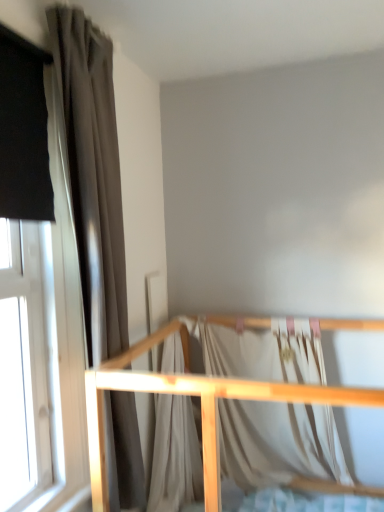
Question: Is light wood crib rail at lower center far away from silky white fabric at center?

Choices:
 (A) yes
 (B) no

Answer: (B)

Question: From a real-world perspective, is light wood crib rail at lower center beneath silky white fabric at center?

Choices:
 (A) no
 (B) yes

Answer: (B)

Question: Is light wood crib rail at lower center facing towards silky white fabric at center?

Choices:
 (A) no
 (B) yes

Answer: (B)

Question: Is silky white fabric at center inside light wood crib rail at lower center?

Choices:
 (A) yes
 (B) no

Answer: (A)

Question: Is light wood crib rail at lower center further to camera compared to silky white fabric at center?

Choices:
 (A) no
 (B) yes

Answer: (A)

Question: Would you say matte gray curtain at left is to the left or to the right of light wood crib rail at lower center in the picture?

Choices:
 (A) left
 (B) right

Answer: (A)

Question: From a real-world perspective, is matte gray curtain at left physically located above or below light wood crib rail at lower center?

Choices:
 (A) below
 (B) above

Answer: (B)

Question: Looking at the image, does matte gray curtain at left seem bigger or smaller compared to light wood crib rail at lower center?

Choices:
 (A) small
 (B) big

Answer: (A)

Question: Choose the correct answer: Is matte gray curtain at left inside light wood crib rail at lower center or outside it?

Choices:
 (A) inside
 (B) outside

Answer: (B)

Question: From the image's perspective, is light wood crib rail at lower center positioned above or below silky white fabric at center?

Choices:
 (A) above
 (B) below

Answer: (B)

Question: Based on their sizes in the image, would you say light wood crib rail at lower center is bigger or smaller than silky white fabric at center?

Choices:
 (A) small
 (B) big

Answer: (B)

Question: Based on their positions, is light wood crib rail at lower center located to the left or right of silky white fabric at center?

Choices:
 (A) left
 (B) right

Answer: (A)

Question: Is light wood crib rail at lower center inside or outside of silky white fabric at center?

Choices:
 (A) inside
 (B) outside

Answer: (B)

Question: In the image, is silky white fabric at center on the left side or the right side of light wood crib rail at lower center?

Choices:
 (A) left
 (B) right

Answer: (B)

Question: From a real-world perspective, relative to light wood crib rail at lower center, is silky white fabric at center vertically above or below?

Choices:
 (A) below
 (B) above

Answer: (B)